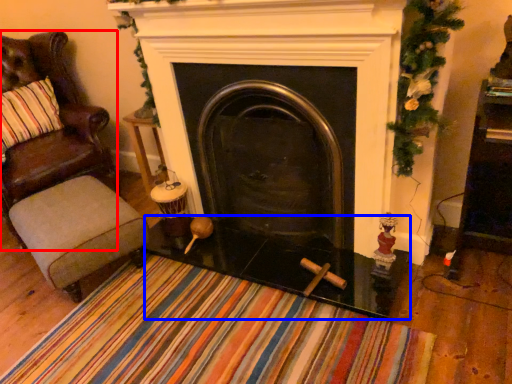
Question: Which object is further to the camera taking this photo, chair (highlighted by a red box) or glass table (highlighted by a blue box)?

Choices:
 (A) chair
 (B) glass table

Answer: (A)